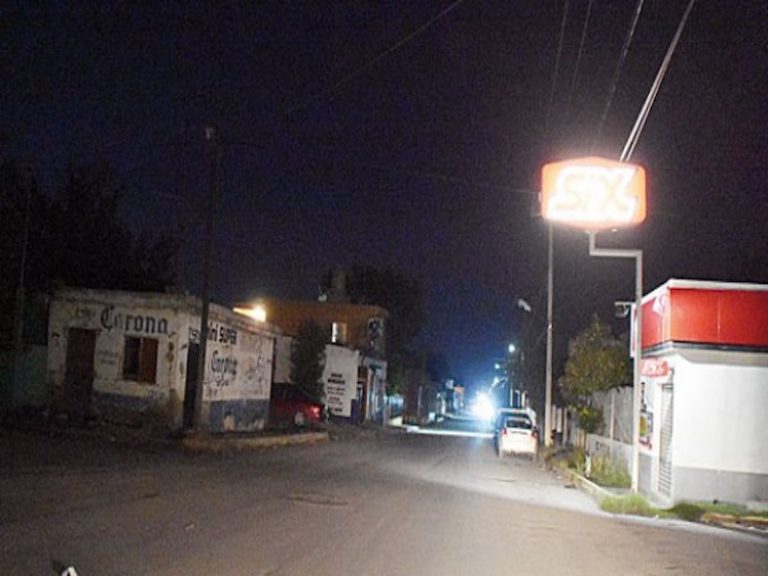
This screenshot has height=576, width=768. I want to click on light, so click(485, 416).